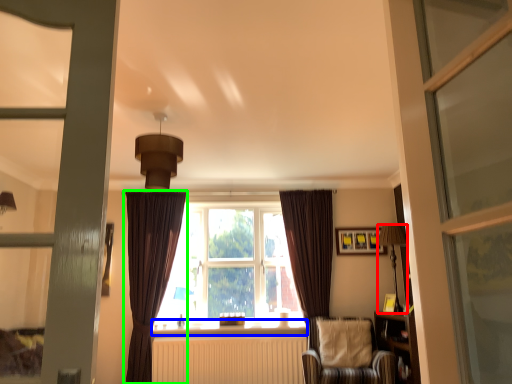
Question: Which is farther away from light fixture (highlighted by a red box)? window sill (highlighted by a blue box) or curtain (highlighted by a green box)?

Choices:
 (A) window sill
 (B) curtain

Answer: (B)